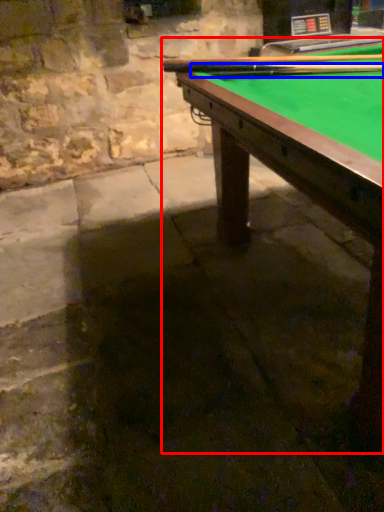
Question: Among these objects, which one is farthest to the camera, billiard table (highlighted by a red box) or cue (highlighted by a blue box)?

Choices:
 (A) billiard table
 (B) cue

Answer: (B)